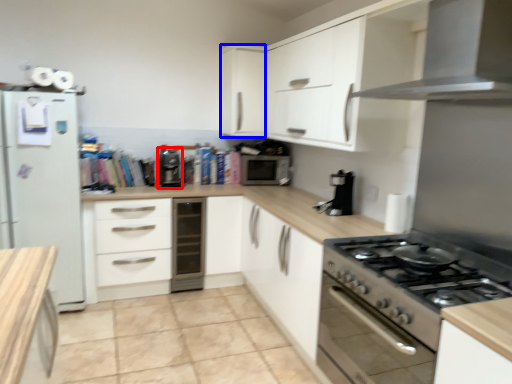
Question: Which object appears farthest to the camera in this image, coffee machine (highlighted by a red box) or cabinetry (highlighted by a blue box)?

Choices:
 (A) coffee machine
 (B) cabinetry

Answer: (B)